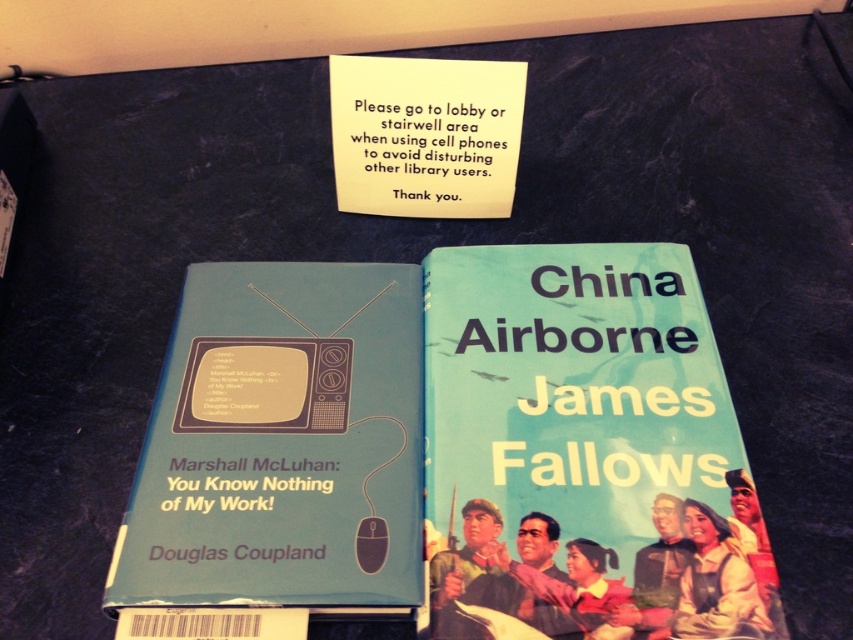
Does blue hardcover book at center have a lesser width compared to yellow paper at upper center?

Incorrect, blue hardcover book at center's width is not less than yellow paper at upper center's.

Which is behind, point (555, 524) or point (376, 99)?

The point (376, 99) is more distant.

Locate an element on the screen. blue hardcover book at center is located at coordinates (584, 452).

Is blue hardcover book at center in front of blue matte book at left?

Yes.

Does blue hardcover book at center appear over blue matte book at left?

Yes, blue hardcover book at center is above blue matte book at left.

Identify the location of blue hardcover book at center. (584, 452).

I want to click on blue hardcover book at center, so click(584, 452).

Between blue matte book at left and yellow paper at upper center, which one has more height?

blue matte book at left is taller.

Does blue matte book at left have a greater width compared to yellow paper at upper center?

Correct, the width of blue matte book at left exceeds that of yellow paper at upper center.

Where is `blue matte book at left`? Image resolution: width=853 pixels, height=640 pixels. blue matte book at left is located at coordinates (281, 444).